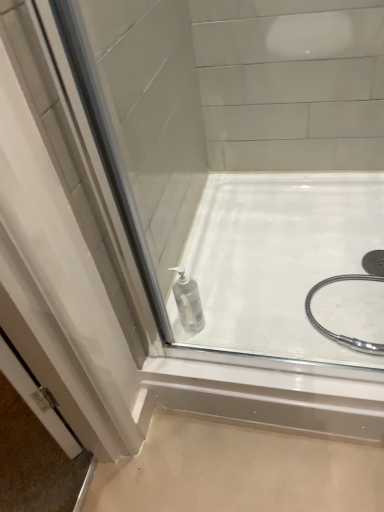
Question: From a real-world perspective, is transparent plastic bottle at center physically above transparent plastic bottle at lower center?

Choices:
 (A) no
 (B) yes

Answer: (A)

Question: Is transparent plastic bottle at center to the right of transparent plastic bottle at lower center from the viewer's perspective?

Choices:
 (A) yes
 (B) no

Answer: (A)

Question: Is transparent plastic bottle at center bigger than transparent plastic bottle at lower center?

Choices:
 (A) no
 (B) yes

Answer: (B)

Question: Can transparent plastic bottle at lower center be found inside transparent plastic bottle at center?

Choices:
 (A) no
 (B) yes

Answer: (A)

Question: Is transparent plastic bottle at center far from transparent plastic bottle at lower center?

Choices:
 (A) yes
 (B) no

Answer: (B)

Question: Considering the relative sizes of transparent plastic bottle at center and transparent plastic bottle at lower center in the image provided, is transparent plastic bottle at center wider than transparent plastic bottle at lower center?

Choices:
 (A) no
 (B) yes

Answer: (B)

Question: From a real-world perspective, is transparent plastic bottle at lower center under transparent plastic bottle at center?

Choices:
 (A) no
 (B) yes

Answer: (A)

Question: Is transparent plastic bottle at lower center not inside transparent plastic bottle at center?

Choices:
 (A) yes
 (B) no

Answer: (A)

Question: From a real-world perspective, is transparent plastic bottle at lower center located higher than transparent plastic bottle at center?

Choices:
 (A) no
 (B) yes

Answer: (B)

Question: Can you confirm if transparent plastic bottle at lower center is positioned to the right of transparent plastic bottle at center?

Choices:
 (A) no
 (B) yes

Answer: (A)

Question: Does transparent plastic bottle at lower center lie behind transparent plastic bottle at center?

Choices:
 (A) no
 (B) yes

Answer: (B)

Question: Is transparent plastic bottle at lower center with transparent plastic bottle at center?

Choices:
 (A) no
 (B) yes

Answer: (A)

Question: Is transparent plastic bottle at lower center in front of or behind transparent plastic bottle at center in the image?

Choices:
 (A) behind
 (B) front

Answer: (A)